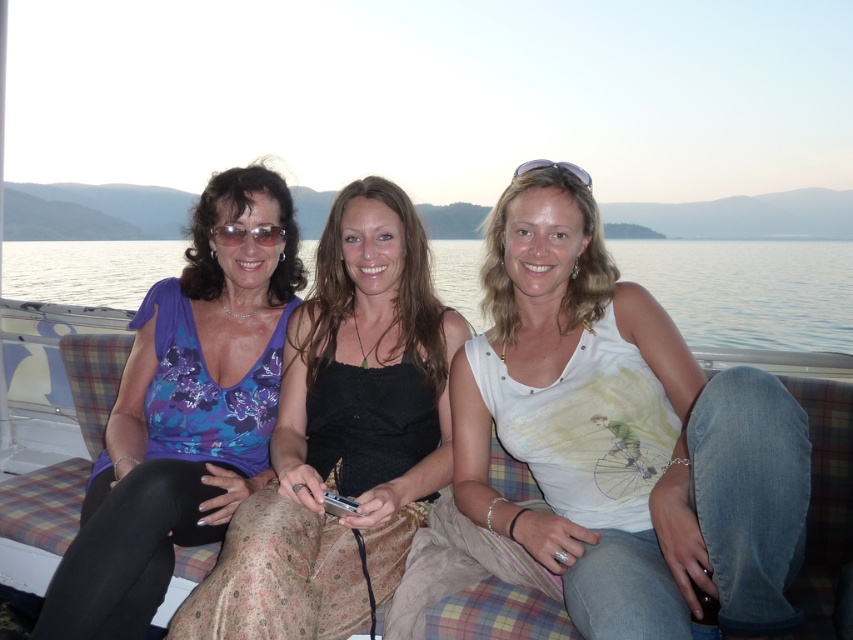
You are a photographer trying to capture a closeup shot of the matte black sunglasses at center and the matte black goggles at upper center. Which object should you focus on first if you want to ensure both are in focus without adjusting your camera settings?

The matte black sunglasses at center is not as tall as the matte black goggles at upper center, so you should focus on the matte black goggles at upper center first because it is taller and requires a closer focus distance.

You are a photographer trying to capture a candid shot of the two women in the image. You want to ensure that both the floral print tank top at center and the matte purple blouse at left are clearly visible in the frame. Based on their positions, which clothing item is closer to the camera?

The floral print tank top at center is positioned under the matte purple blouse at left, so the matte purple blouse at left is closer to the camera.

You are standing in front of the image and want to determine which of the two points, point (614, 413) or point (589, 186), is nearer to you. Based on the scene, which point is closer?

Point (614, 413) is closer to the viewer than point (589, 186).